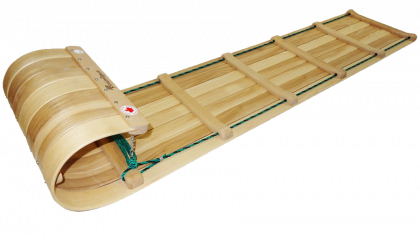
At what (x,y) coordinates should I click in order to perform the action: click on darker wood. Please return your answer as a coordinate pair (x, y). Looking at the image, I should click on (173, 140), (150, 88).